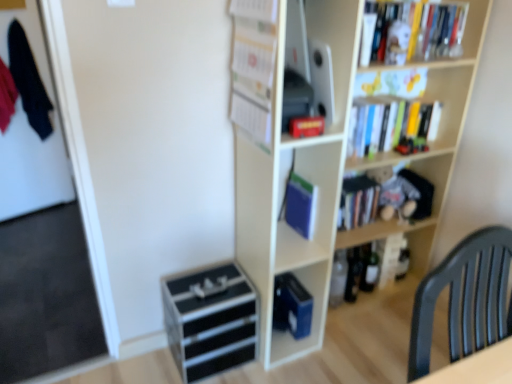
At what (x,y) coordinates should I click in order to perform the action: click on empty space that is ontop of hardcover book at upper right, placed as the first book when sorted from top to bottom. Please return your answer as a coordinate pair (x, y). Looking at the image, I should click on (412, 0).